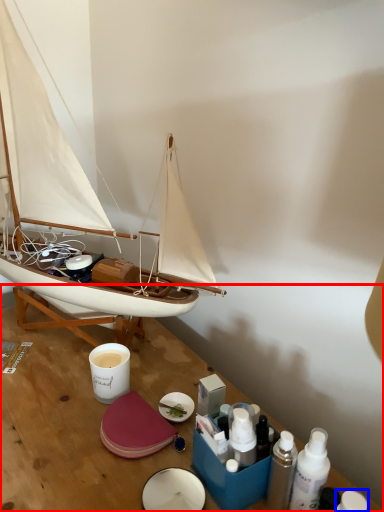
Question: Which point is further to the camera, table (highlighted by a red box) or toiletry (highlighted by a blue box)?

Choices:
 (A) table
 (B) toiletry

Answer: (B)